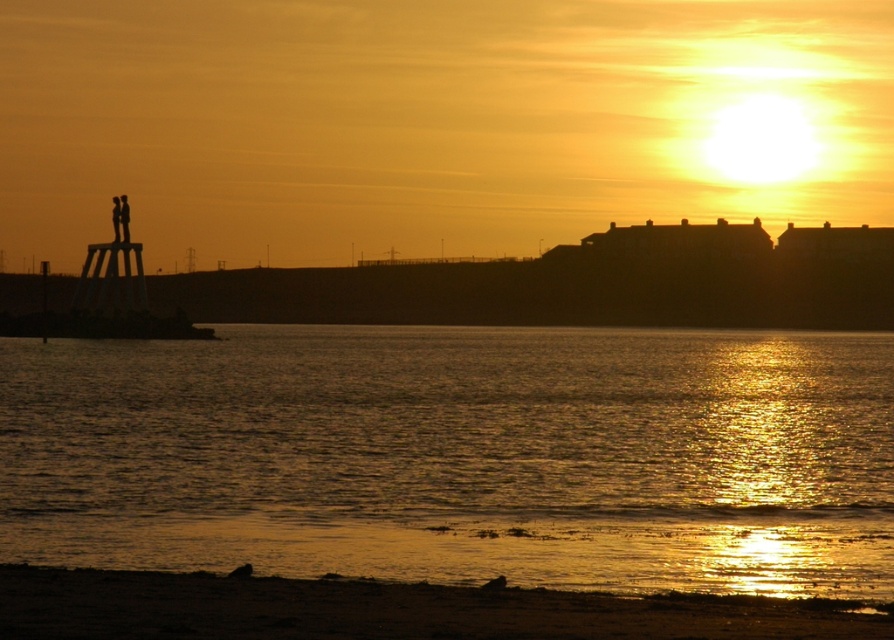
You are an artist planning to paint the sunset scene. You want to ensure the black silhouette at left and the silhouette figure at left are proportionally accurate. Which one should you draw wider to maintain the correct proportions?

The silhouette figure at left should be drawn wider than the black silhouette at left since the black silhouette at left is narrower according to their widths described.

You are standing on the sandy brown beach at lower center and want to reach the golden reflective water at lower center. Based on the scene description, which direction should you move to get to the water?

Since the golden reflective water at lower center has a greater height than the sandy brown beach at lower center, you should move towards the direction where the elevation decreases, which would be towards the water. However, in typical beach scenarios, water is lower than the beach, so this might indicate an unusual perspective or terrain. Follow the slope towards the golden reflective water at lower center as described.

You are standing on the beach and want to take a photo of the black silhouette at left. If you are currently 200 meters away from it, how much closer do you need to get to be exactly at the specified distance?

The black silhouette at left is currently 219.98 meters away. To be exactly at the specified distance of 200 meters, you need to move 19.98 meters closer.